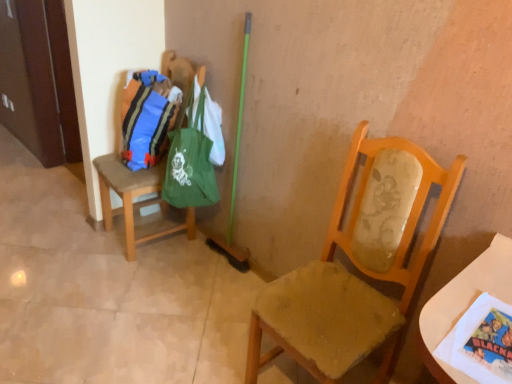
Question: Is white paper at lower right located outside green fabric bag at upper left, marked as the second bag in a left-to-right arrangement?

Choices:
 (A) no
 (B) yes

Answer: (B)

Question: Can you confirm if white paper at lower right is thinner than green fabric bag at upper left, marked as the second bag in a left-to-right arrangement?

Choices:
 (A) no
 (B) yes

Answer: (B)

Question: From a real-world perspective, is white paper at lower right positioned over green fabric bag at upper left, marked as the second bag in a left-to-right arrangement, based on gravity?

Choices:
 (A) yes
 (B) no

Answer: (A)

Question: Can you confirm if white paper at lower right is bigger than green fabric bag at upper left, marked as the second bag in a left-to-right arrangement?

Choices:
 (A) no
 (B) yes

Answer: (A)

Question: Is white paper at lower right at the right side of green fabric bag at upper left, placed as the 1th bag when sorted from right to left?

Choices:
 (A) yes
 (B) no

Answer: (A)

Question: Is green fabric bag at upper left, placed as the 1th bag when sorted from right to left, inside the boundaries of white paper at lower right, or outside?

Choices:
 (A) inside
 (B) outside

Answer: (B)

Question: From a real-world perspective, is green fabric bag at upper left, placed as the 1th bag when sorted from right to left, positioned above or below white paper at lower right?

Choices:
 (A) above
 (B) below

Answer: (B)

Question: From the image's perspective, is green fabric bag at upper left, marked as the second bag in a left-to-right arrangement, located above or below white paper at lower right?

Choices:
 (A) above
 (B) below

Answer: (A)

Question: Considering the positions of green fabric bag at upper left, marked as the second bag in a left-to-right arrangement, and white paper at lower right in the image, is green fabric bag at upper left, marked as the second bag in a left-to-right arrangement, wider or thinner than white paper at lower right?

Choices:
 (A) thin
 (B) wide

Answer: (B)

Question: In terms of height, does white paper at lower right look taller or shorter compared to wooden chair at center, which is the 2th chair in back-to-front order?

Choices:
 (A) short
 (B) tall

Answer: (A)

Question: From a real-world perspective, is white paper at lower right above or below wooden chair at center, positioned as the 2th chair in left-to-right order?

Choices:
 (A) above
 (B) below

Answer: (A)

Question: In the image, is white paper at lower right positioned in front of or behind wooden chair at center, the first chair in the front-to-back sequence?

Choices:
 (A) front
 (B) behind

Answer: (A)

Question: From the image's perspective, is white paper at lower right positioned above or below wooden chair at center, positioned as the 2th chair in left-to-right order?

Choices:
 (A) above
 (B) below

Answer: (B)

Question: Looking at their shapes, would you say matte blue fabric bag at left, the 2th bag in the right-to-left sequence, is wider or thinner than brown fabric chair at left, marked as the second chair in a front-to-back arrangement?

Choices:
 (A) wide
 (B) thin

Answer: (B)

Question: From a real-world perspective, relative to brown fabric chair at left, which appears as the second chair when viewed from the right, is matte blue fabric bag at left, the 2th bag in the right-to-left sequence, vertically above or below?

Choices:
 (A) above
 (B) below

Answer: (A)